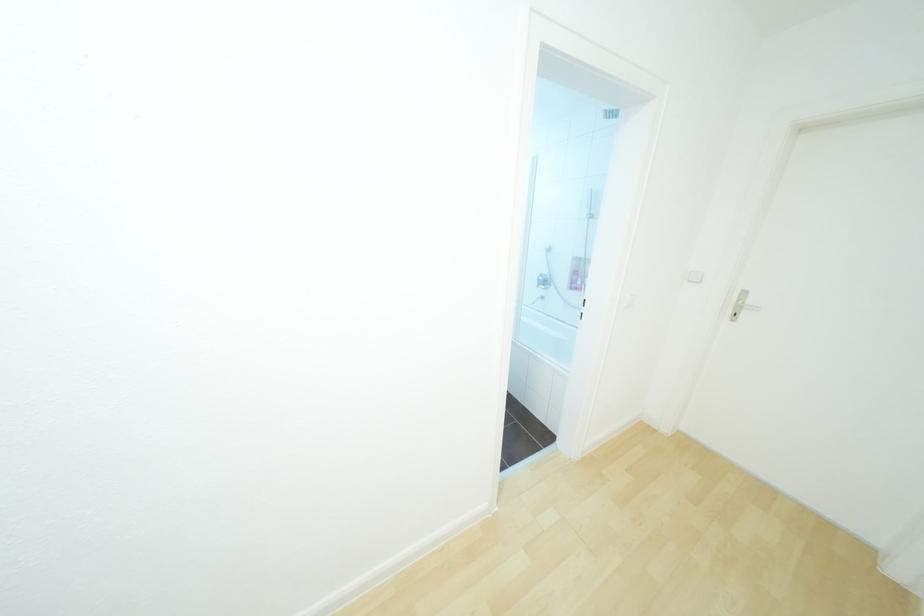
Where would you turn the faucet handle? Please return your answer as a coordinate pair (x, y).

(542, 281)